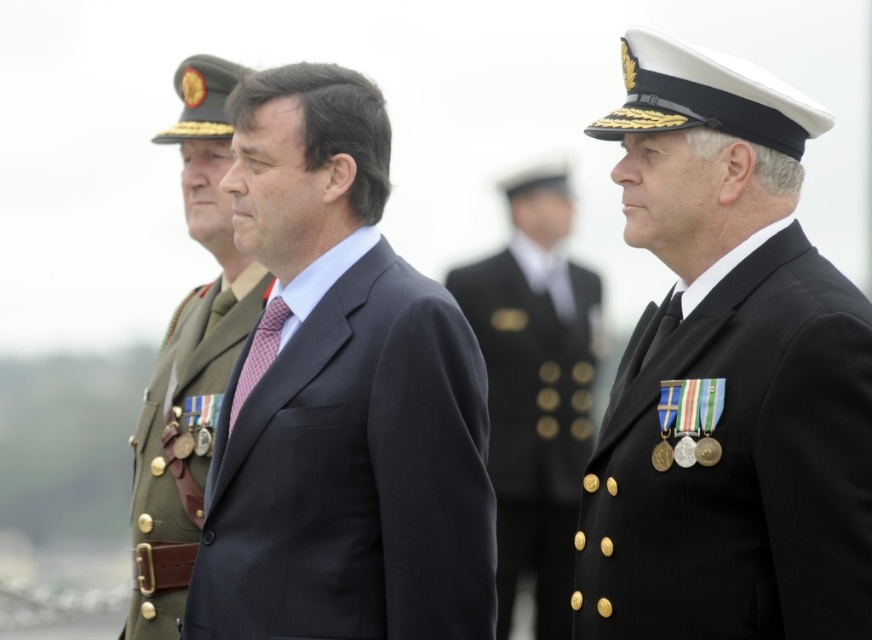
You are a photographer at the event and need to adjust the camera focus to ensure both the black woolen suit at center and the matte black suit at center are in frame. Which suit should you focus on first to account for their height difference?

The black woolen suit at center is shorter than the matte black suit at center, so you should focus on the matte black suit at center first to ensure both are in frame.

You are a photographer at the event and need to focus your camera on the black woolen suit at center and the shiny gold buttons at center. Which one requires a closer focus to capture details clearly?

The shiny gold buttons at center are smaller than the black woolen suit at center, so you need to focus closer on the shiny gold buttons at center to capture their details clearly.

You are standing at the point with coordinates point (645, 538) and want to move to the point (513, 429). Which direction should you move to get closer to the camera?

Moving towards point (513, 429) would take you away from the camera since point (645, 538) is already closer to the camera than point (513, 429). To move closer to the camera, you should stay at point (645, 538) or move in the opposite direction.